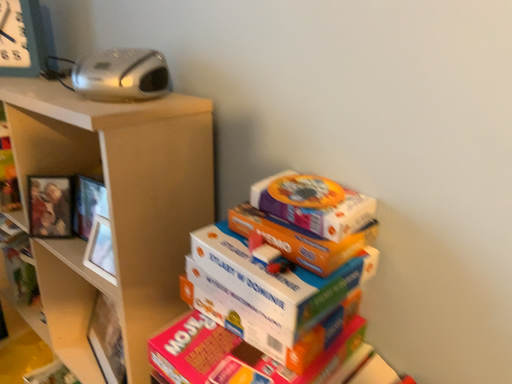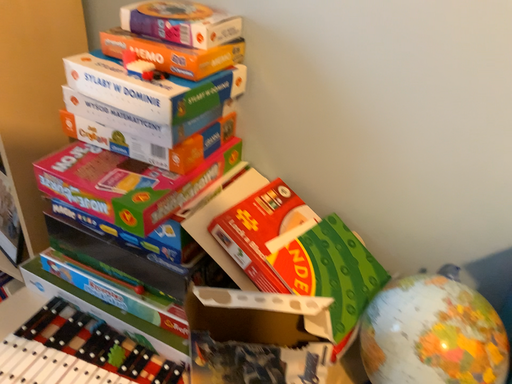
Question: Which way did the camera rotate in the video?

Choices:
 (A) rotated upward
 (B) rotated downward

Answer: (B)